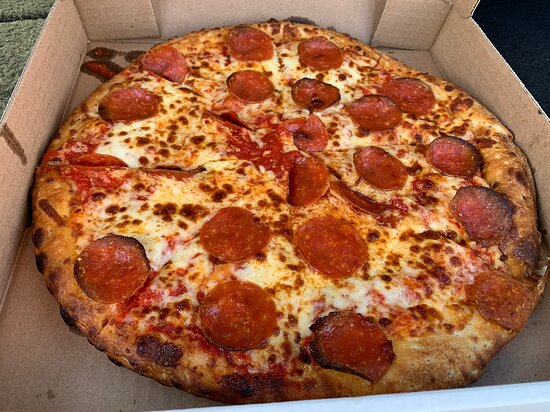
Where is `brown carpet`? This screenshot has width=550, height=412. brown carpet is located at coordinates (21, 45).